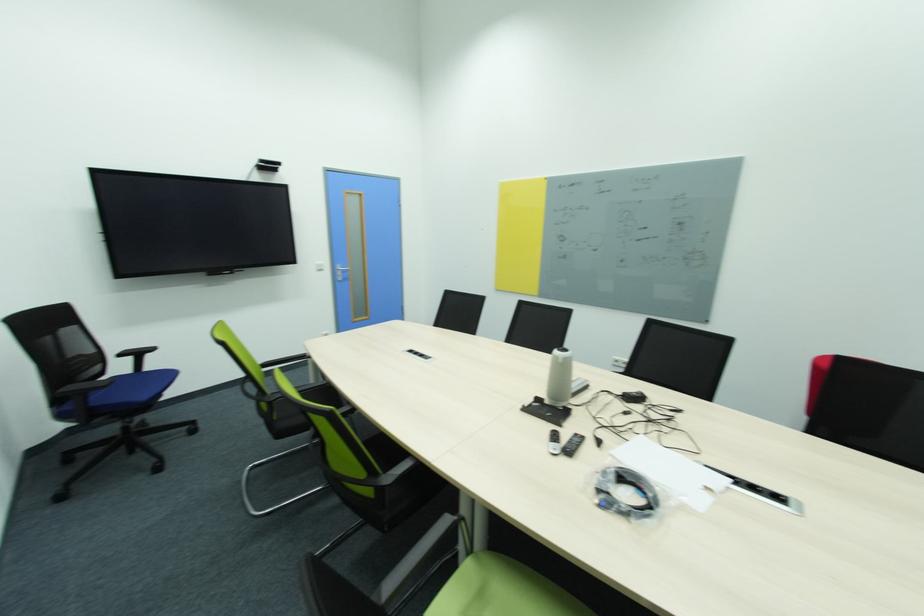
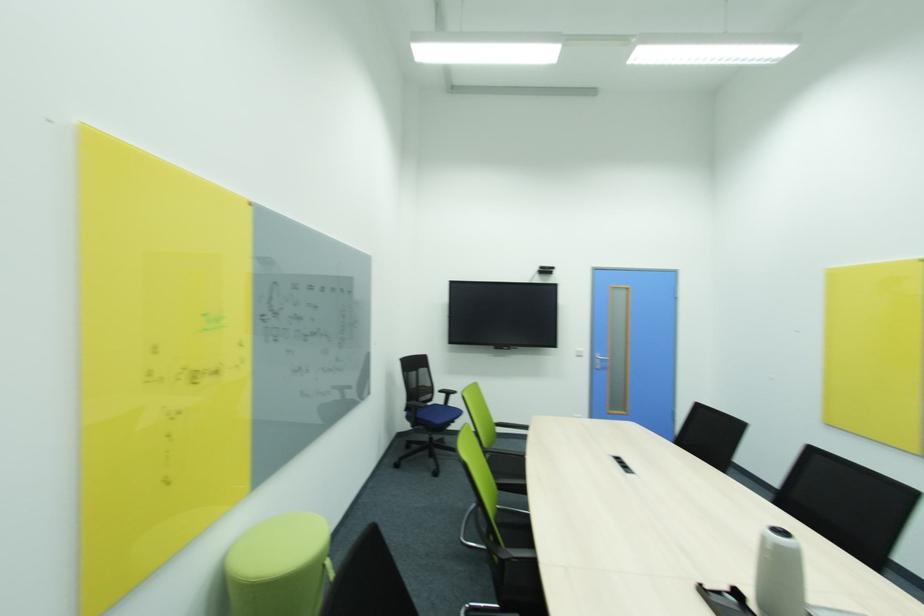
In the second image, find the point that corresponds to (x=149, y=397) in the first image.

(442, 422)